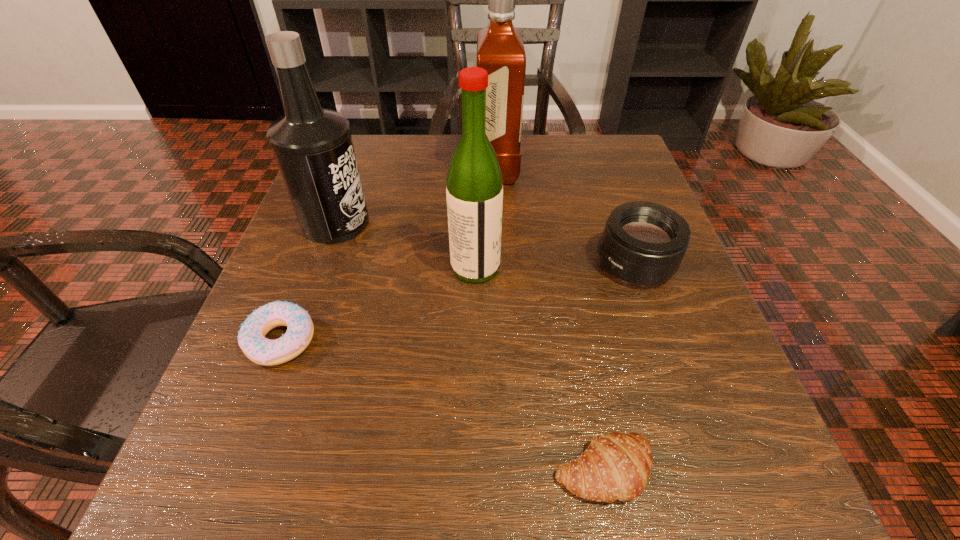
Image resolution: width=960 pixels, height=540 pixels. I want to click on vacant space located on the label of the nearest liquor, so click(x=586, y=267).

The width and height of the screenshot is (960, 540). What are the coordinates of `free space located 0.200m on the side of the third shortest object with brand markings and control switches` in the screenshot? It's located at (482, 264).

At what (x,y) coordinates should I click in order to perform the action: click on free spot located on the side of the third shortest object with brand markings and control switches. Please return your answer as a coordinate pair (x, y). Image resolution: width=960 pixels, height=540 pixels. Looking at the image, I should click on (425, 264).

Where is `free location located on the side of the third shortest object with brand markings and control switches`? This screenshot has width=960, height=540. free location located on the side of the third shortest object with brand markings and control switches is located at coordinates (562, 264).

Locate an element on the screen. This screenshot has width=960, height=540. vacant space located on the right of the nearest object is located at coordinates (770, 471).

The height and width of the screenshot is (540, 960). What are the coordinates of `free location located 0.090m on the back of the second nearest object` in the screenshot? It's located at (306, 274).

Where is `object positioned at the far edge`? The height and width of the screenshot is (540, 960). object positioned at the far edge is located at coordinates (500, 50).

Locate an element on the screen. The width and height of the screenshot is (960, 540). object at the near edge is located at coordinates (616, 466).

You are a GUI agent. You are given a task and a screenshot of the screen. Output one action in this format:
    pyautogui.click(x=<x>, y=<y>)
    Task: Click on the liquor at the left edge
    
    Given the screenshot: What is the action you would take?
    pyautogui.click(x=313, y=146)

Locate an element on the screen. The height and width of the screenshot is (540, 960). doughnut at the left edge is located at coordinates (251, 338).